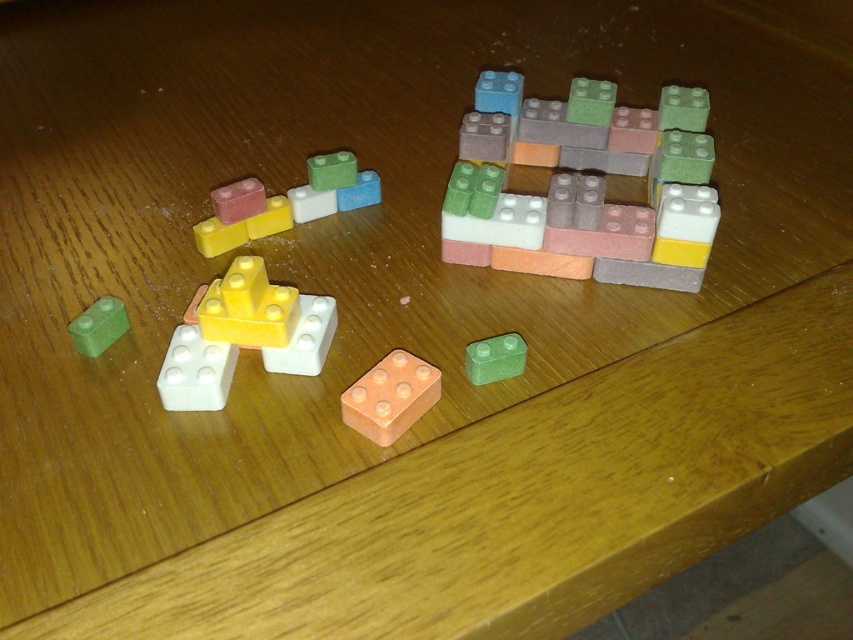
Is pastel rubber blocks at center to the left of matte yellow brick at center from the viewer's perspective?

No, pastel rubber blocks at center is not to the left of matte yellow brick at center.

Can you confirm if pastel rubber blocks at center is taller than matte yellow brick at center?

Yes, pastel rubber blocks at center is taller than matte yellow brick at center.

The width and height of the screenshot is (853, 640). What are the coordinates of `pastel rubber blocks at center` in the screenshot? It's located at (583, 186).

Locate an element on the screen. This screenshot has width=853, height=640. pastel rubber blocks at center is located at coordinates (583, 186).

Does point (463, 168) come in front of point (340, 209)?

Yes, it is.

Is pastel rubber blocks at center thinner than pastel plastic blocks at upper left?

Incorrect, pastel rubber blocks at center's width is not less than pastel plastic blocks at upper left's.

Between point (683, 196) and point (376, 182), which one is positioned behind?

Point (376, 182)

At what (x,y) coordinates should I click in order to perform the action: click on pastel rubber blocks at center. Please return your answer as a coordinate pair (x, y). The image size is (853, 640). Looking at the image, I should click on (583, 186).

Looking at this image, between pastel plastic blocks at upper left and orange matte brick at center, which one appears on the left side from the viewer's perspective?

Positioned to the left is pastel plastic blocks at upper left.

Who is more forward, (245, 218) or (410, 417)?

Point (410, 417)

Who is more forward, (325, 209) or (370, 394)?

Positioned in front is point (370, 394).

What are the coordinates of `pastel plastic blocks at upper left` in the screenshot? It's located at (283, 204).